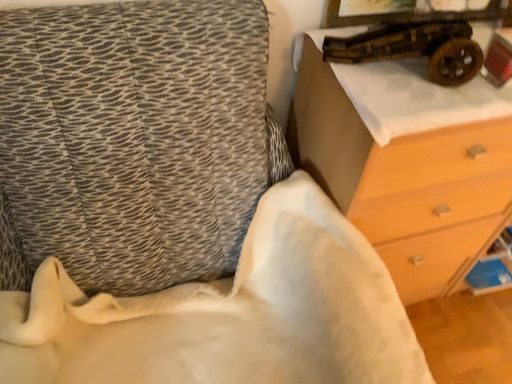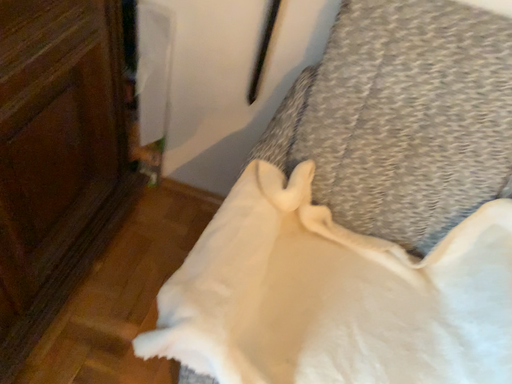
Question: How did the camera likely rotate when shooting the video?

Choices:
 (A) rotated right
 (B) rotated left

Answer: (B)